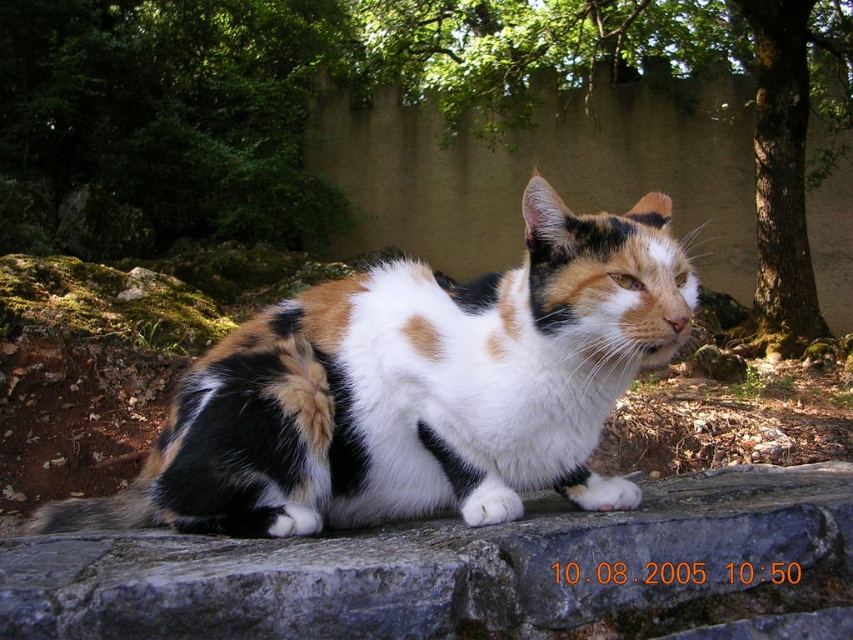
Looking at this image, you are a small robot with a diameter of 10 inches. You want to move from the calico fur cat at center to the gray stone at center. Can you fit through the space between them?

The distance between the calico fur cat at center and the gray stone at center is 10.99 inches. Since your diameter is 10 inches, you can fit through the space between them as the distance is slightly larger than your size.

You are a photographer wanting to capture the calico fur cat at center and the green leafy tree at upper center in the same frame. Based on their sizes, which one will appear larger in the photo?

The calico fur cat at center will appear larger in the photo because its width surpasses that of the green leafy tree at upper center.